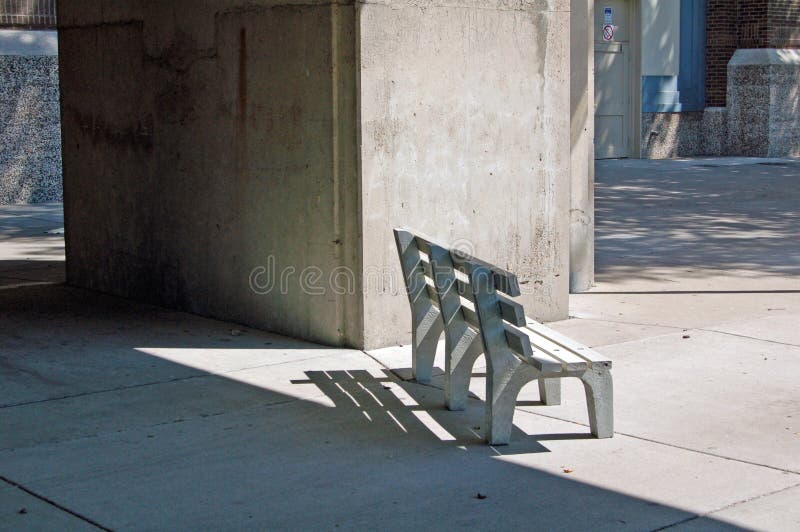
Locate an element on the screen. The width and height of the screenshot is (800, 532). chair shadow is located at coordinates (392, 404).